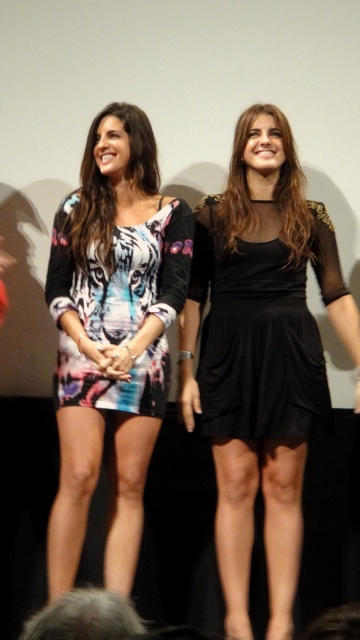
Question: Estimate the real-world distances between objects in this image. Which object is closer to the printed fabric dress at left?

Choices:
 (A) printed fabric dress at center
 (B) black velvet dress at center
 (C) black sheer dress at center
 (D) matte black dress at center

Answer: (A)

Question: From the image, what is the correct spatial relationship of black sheer dress at center in relation to printed fabric dress at center?

Choices:
 (A) left
 (B) right

Answer: (B)

Question: Estimate the real-world distances between objects in this image. Which object is farther from the printed fabric dress at center?

Choices:
 (A) black sheer dress at center
 (B) matte black dress at center

Answer: (B)

Question: Which point is farther from the camera taking this photo?

Choices:
 (A) (124, 221)
 (B) (277, 161)
 (C) (42, 612)

Answer: (B)

Question: Is printed fabric dress at center wider than matte black dress at center?

Choices:
 (A) yes
 (B) no

Answer: (A)

Question: Is printed fabric dress at center positioned behind matte black dress at center?

Choices:
 (A) yes
 (B) no

Answer: (A)